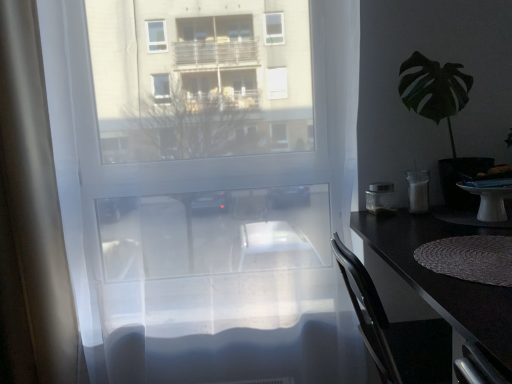
Question: Does black glossy desk at right lie in front of green leafy plant at right?

Choices:
 (A) no
 (B) yes

Answer: (B)

Question: Is black glossy desk at right wider than green leafy plant at right?

Choices:
 (A) no
 (B) yes

Answer: (B)

Question: From the image's perspective, is black glossy desk at right on top of green leafy plant at right?

Choices:
 (A) no
 (B) yes

Answer: (A)

Question: From a real-world perspective, is black glossy desk at right located beneath green leafy plant at right?

Choices:
 (A) yes
 (B) no

Answer: (A)

Question: Are black glossy desk at right and green leafy plant at right making contact?

Choices:
 (A) yes
 (B) no

Answer: (B)

Question: Looking at their shapes, would you say green leafy plant at right is wider or thinner than black glossy desk at right?

Choices:
 (A) wide
 (B) thin

Answer: (B)

Question: Is green leafy plant at right situated inside black glossy desk at right or outside?

Choices:
 (A) outside
 (B) inside

Answer: (A)

Question: Considering the positions of point (443, 165) and point (496, 342), is point (443, 165) closer or farther from the camera than point (496, 342)?

Choices:
 (A) farther
 (B) closer

Answer: (A)

Question: From the image's perspective, is green leafy plant at right located above or below black glossy desk at right?

Choices:
 (A) below
 (B) above

Answer: (B)

Question: Considering their positions, is green leafy plant at right located in front of or behind white opaque glass at right, placed as the first appliance when sorted from right to left?

Choices:
 (A) front
 (B) behind

Answer: (A)

Question: Do you think green leafy plant at right is within white opaque glass at right, placed as the first appliance when sorted from right to left, or outside of it?

Choices:
 (A) outside
 (B) inside

Answer: (A)

Question: Considering the positions of green leafy plant at right and white opaque glass at right, placed as the first appliance when sorted from right to left, in the image, is green leafy plant at right bigger or smaller than white opaque glass at right, placed as the first appliance when sorted from right to left,?

Choices:
 (A) small
 (B) big

Answer: (B)

Question: From the image's perspective, relative to white opaque glass at right, which is counted as the second appliance, starting from the left, is green leafy plant at right above or below?

Choices:
 (A) below
 (B) above

Answer: (B)

Question: From the image's perspective, is metallic silver container at right, marked as the 1th appliance in a left-to-right arrangement, positioned above or below white opaque glass at right, placed as the first appliance when sorted from right to left?

Choices:
 (A) above
 (B) below

Answer: (B)

Question: Considering the relative positions of metallic silver container at right, marked as the 1th appliance in a left-to-right arrangement, and white opaque glass at right, placed as the first appliance when sorted from right to left, in the image provided, is metallic silver container at right, marked as the 1th appliance in a left-to-right arrangement, to the left or to the right of white opaque glass at right, placed as the first appliance when sorted from right to left,?

Choices:
 (A) left
 (B) right

Answer: (A)